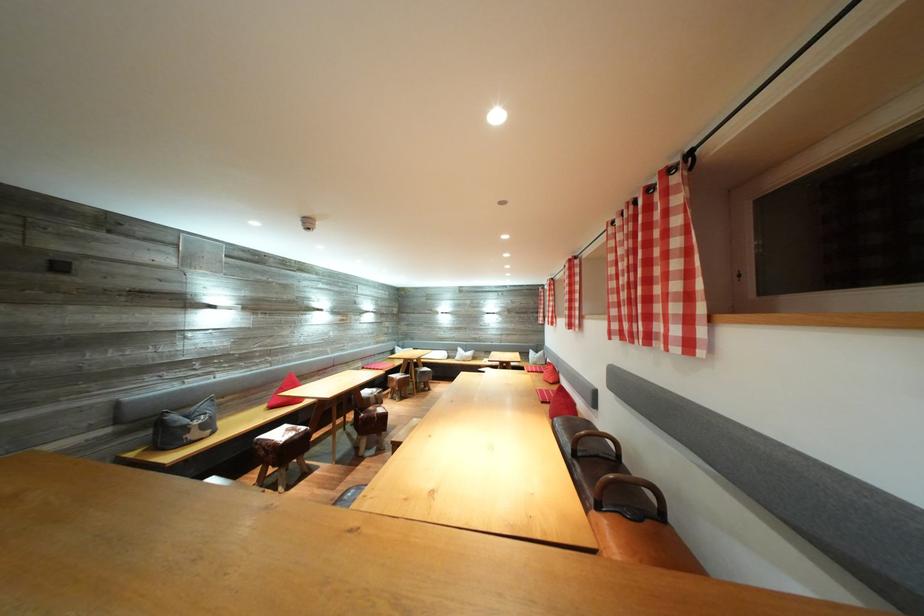
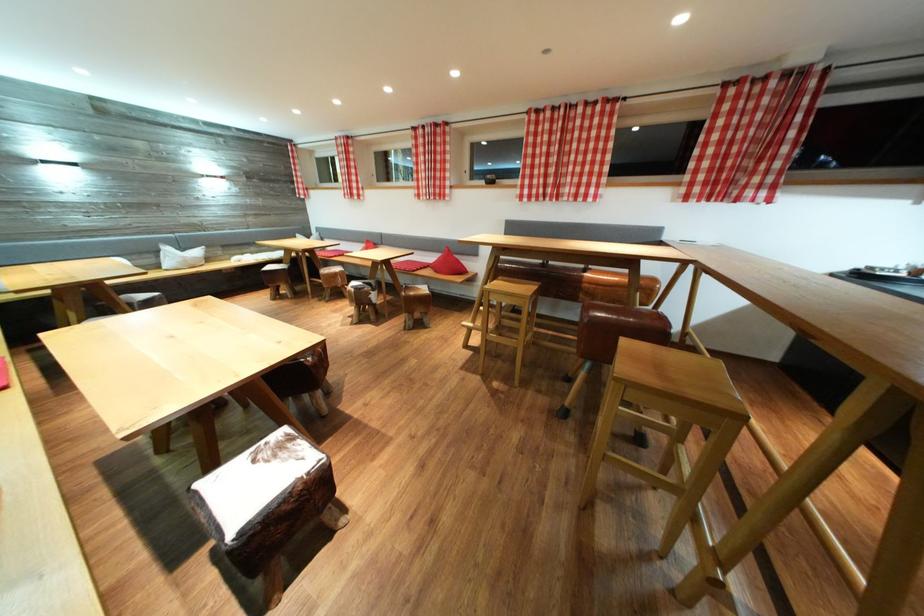
The point at (467, 355) is marked in the first image. Where is the corresponding point in the second image?

(176, 254)